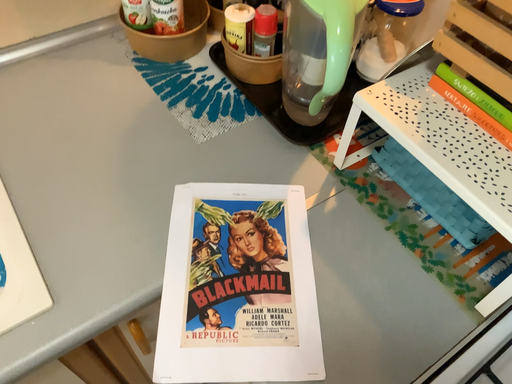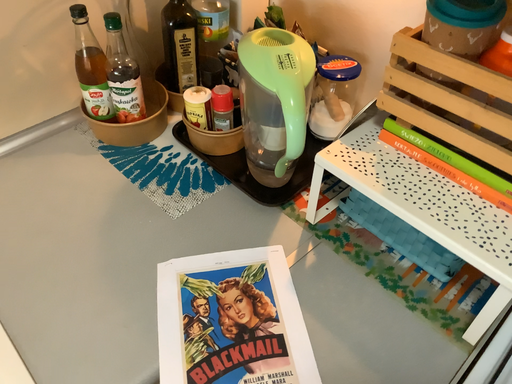
Question: How did the camera likely rotate when shooting the video?

Choices:
 (A) rotated upward
 (B) rotated downward

Answer: (A)